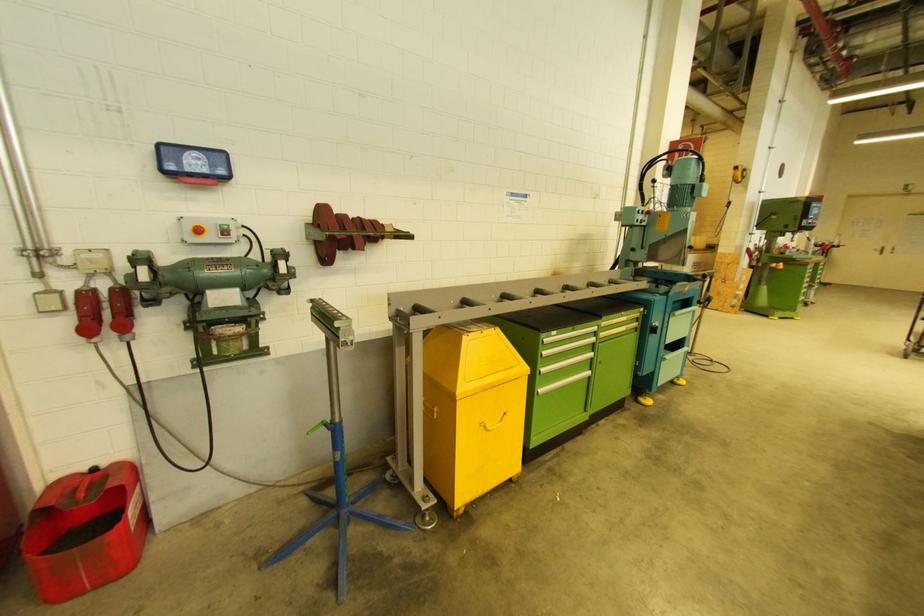
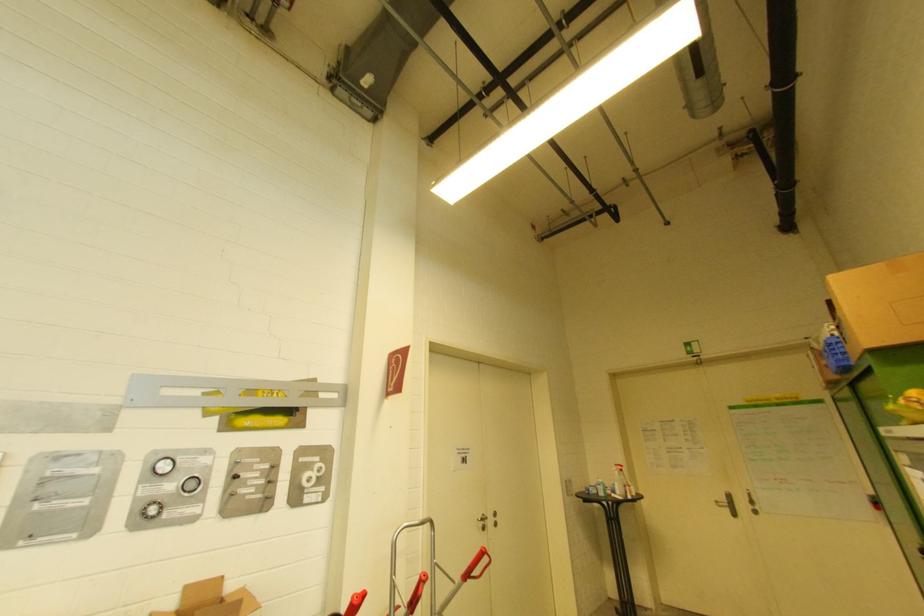
Find the pixel in the second image that matches the point at 885,249 in the first image.

(731, 498)